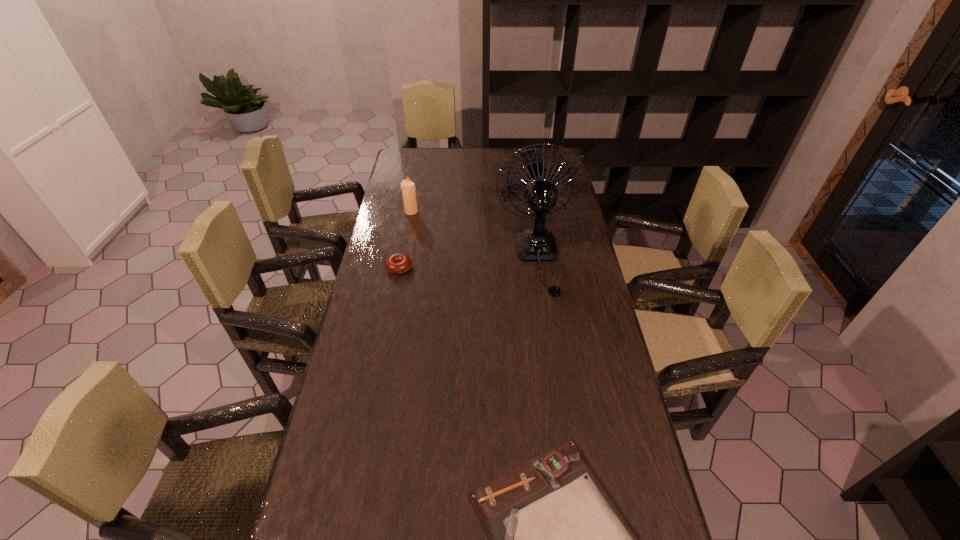
The width and height of the screenshot is (960, 540). I want to click on the tallest object, so click(x=533, y=244).

Where is `the farthest object`? The image size is (960, 540). the farthest object is located at coordinates (408, 187).

Find the location of a particular element. candle is located at coordinates (408, 187).

Image resolution: width=960 pixels, height=540 pixels. In order to click on doughnut in this screenshot , I will do `click(398, 263)`.

Image resolution: width=960 pixels, height=540 pixels. I want to click on blank space located in front of the fan, indicating the direction of air flow, so click(548, 333).

Image resolution: width=960 pixels, height=540 pixels. Find the location of `vacant space positioned 0.280m on the front of the farthest object`. vacant space positioned 0.280m on the front of the farthest object is located at coordinates (401, 262).

I want to click on free space located 0.180m on the right of the second shortest object, so click(x=463, y=268).

You are a GUI agent. You are given a task and a screenshot of the screen. Output one action in this format:
    pyautogui.click(x=<x>, y=<y>)
    Task: Click on the candle positioned at the left edge
    The width and height of the screenshot is (960, 540).
    Given the screenshot: What is the action you would take?
    pyautogui.click(x=408, y=187)

The width and height of the screenshot is (960, 540). I want to click on doughnut present at the left edge, so click(398, 263).

You are a GUI agent. You are given a task and a screenshot of the screen. Output one action in this format:
    pyautogui.click(x=<x>, y=<y>)
    Task: Click on the object situated at the right edge
    The width and height of the screenshot is (960, 540).
    Given the screenshot: What is the action you would take?
    pyautogui.click(x=533, y=244)